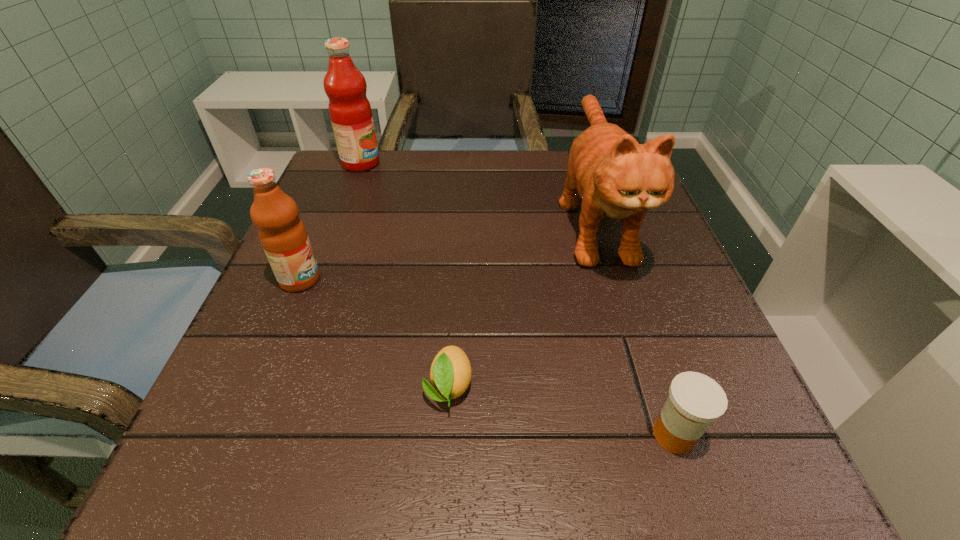
The width and height of the screenshot is (960, 540). Find the location of `object that is at the far right corner`. object that is at the far right corner is located at coordinates (615, 176).

You are a GUI agent. You are given a task and a screenshot of the screen. Output one action in this format:
    pyautogui.click(x=<x>, y=<y>)
    Task: Click on the object present at the near right corner
    
    Given the screenshot: What is the action you would take?
    click(695, 400)

In the image, there is a desktop. Identify the location of vacant space at the far edge. This screenshot has width=960, height=540. (479, 153).

What are the coordinates of `vacant space at the near edge of the desktop` in the screenshot? It's located at (491, 469).

In the image, there is a desktop. Identify the location of vacant space at the left edge. (305, 293).

Locate an element on the screen. Image resolution: width=960 pixels, height=540 pixels. vacant space at the right edge is located at coordinates (656, 364).

Where is `vacant region at the far left corner of the desktop`? This screenshot has width=960, height=540. vacant region at the far left corner of the desktop is located at coordinates (355, 173).

Find the location of a particular element. The image size is (960, 540). vacant region between the third tallest object and the cat is located at coordinates (447, 248).

You are a GUI agent. You are given a task and a screenshot of the screen. Output one action in this format:
    pyautogui.click(x=<x>, y=<y>)
    Task: Click on the vacant space that is in between the shortest object and the third tallest object
    
    Given the screenshot: What is the action you would take?
    pyautogui.click(x=374, y=333)

Where is `free point between the farther fruit juice and the third shortest object`? free point between the farther fruit juice and the third shortest object is located at coordinates (330, 221).